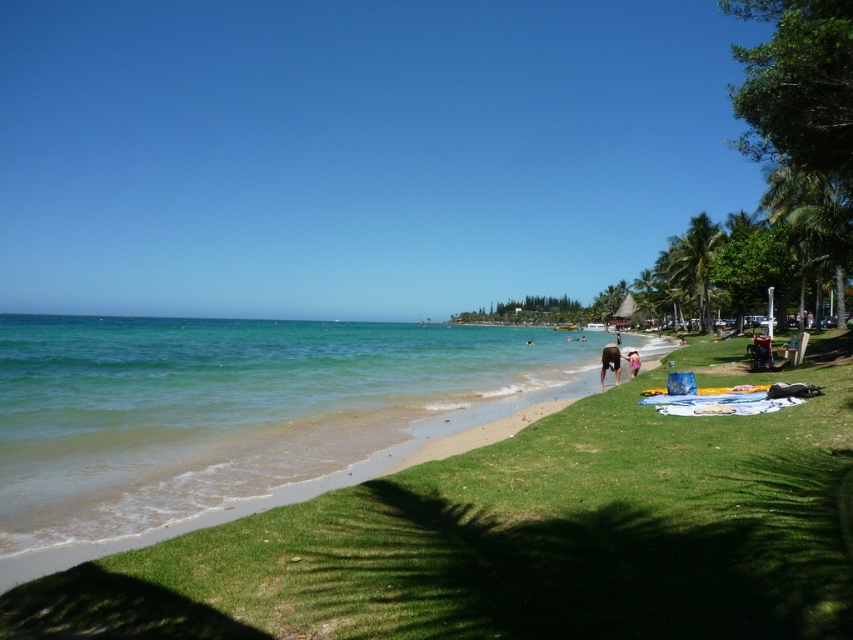
Does green leafy palm tree at upper right have a greater height compared to green leafy palm tree at right?

Yes.

Is green leafy palm tree at upper right bigger than green leafy palm tree at right?

Yes, green leafy palm tree at upper right is bigger than green leafy palm tree at right.

In order to click on green leafy palm tree at upper right in this screenshot , I will do `click(811, 225)`.

This screenshot has width=853, height=640. I want to click on green leafy palm tree at upper right, so click(x=811, y=225).

Who is positioned more to the right, dark brown hair at lower center or pink fabric at lower right?

dark brown hair at lower center

Who is lower down, dark brown hair at lower center or pink fabric at lower right?

Positioned lower is dark brown hair at lower center.

Locate an element on the screen. The image size is (853, 640). dark brown hair at lower center is located at coordinates (610, 362).

Between green leafy palm tree at right and dark brown hair at lower center, which one appears on the right side from the viewer's perspective?

green leafy palm tree at right is more to the right.

Can you confirm if green leafy palm tree at right is taller than dark brown hair at lower center?

Yes, green leafy palm tree at right is taller than dark brown hair at lower center.

At what (x,y) coordinates should I click in order to perform the action: click on green leafy palm tree at right. Please return your answer as a coordinate pair (x, y). Looking at the image, I should click on (694, 260).

The width and height of the screenshot is (853, 640). Identify the location of green leafy palm tree at right. (694, 260).